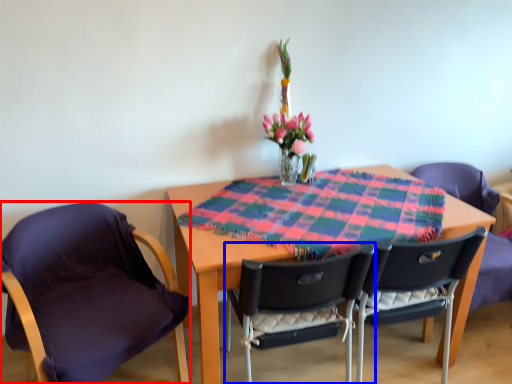
Question: Which object is closer to the camera taking this photo, chair (highlighted by a red box) or chair (highlighted by a blue box)?

Choices:
 (A) chair
 (B) chair

Answer: (A)